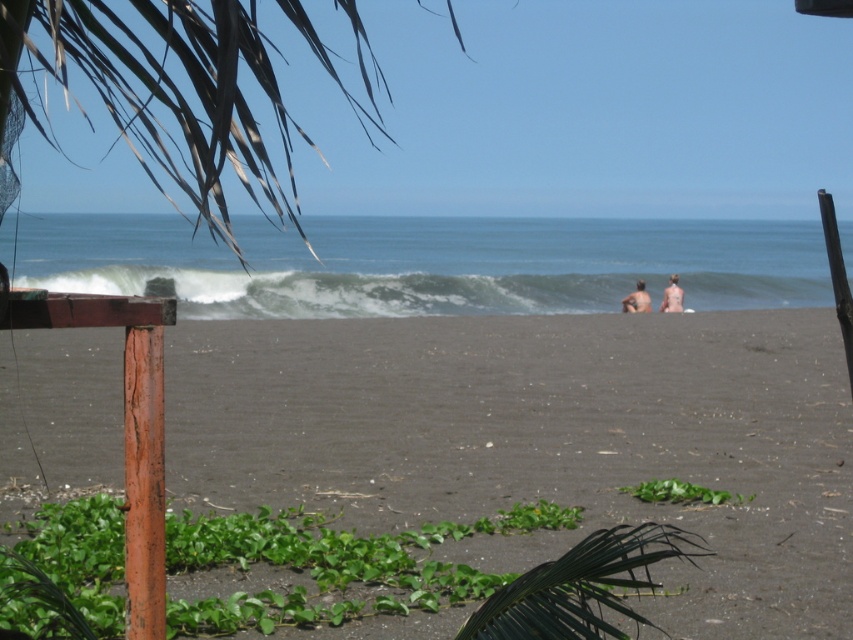
Question: Is dark brown sand at center wider than blonde hair human at right?

Choices:
 (A) no
 (B) yes

Answer: (B)

Question: Among these objects, which one is nearest to the camera?

Choices:
 (A) dark brown sand at center
 (B) naked human at lower right

Answer: (A)

Question: Based on their relative distances, which object is farther from the naked human at lower right?

Choices:
 (A) brown wood pole at lower left
 (B) blonde hair human at right
 (C) dark brown sand at center
 (D) white foamy wave at center

Answer: (A)

Question: Is brown wood pole at lower left wider than blonde hair human at right?

Choices:
 (A) yes
 (B) no

Answer: (B)

Question: Can you confirm if white foamy wave at center is positioned to the right of blonde hair human at right?

Choices:
 (A) no
 (B) yes

Answer: (A)

Question: Based on their relative distances, which object is farther from the brown wood pole at lower left?

Choices:
 (A) dark brown sand at center
 (B) naked human at lower right
 (C) blonde hair human at right
 (D) white foamy wave at center

Answer: (D)